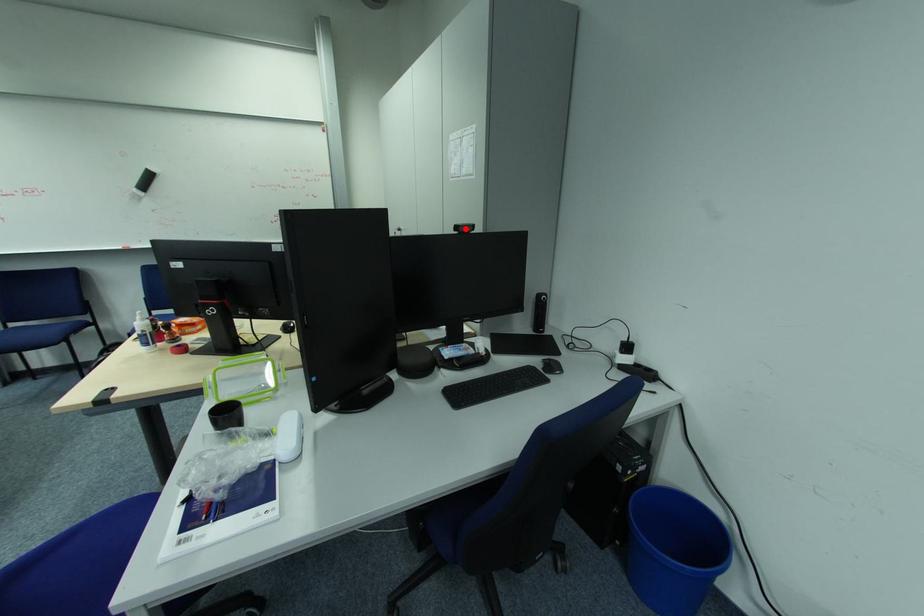
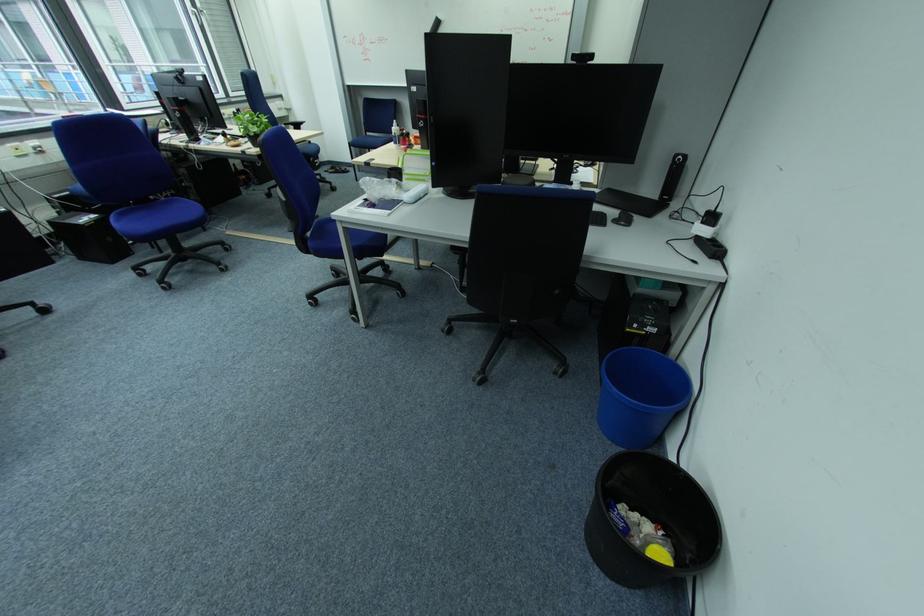
Where in the second image is the point corresponding to the highlighted location from the first image?

(581, 57)